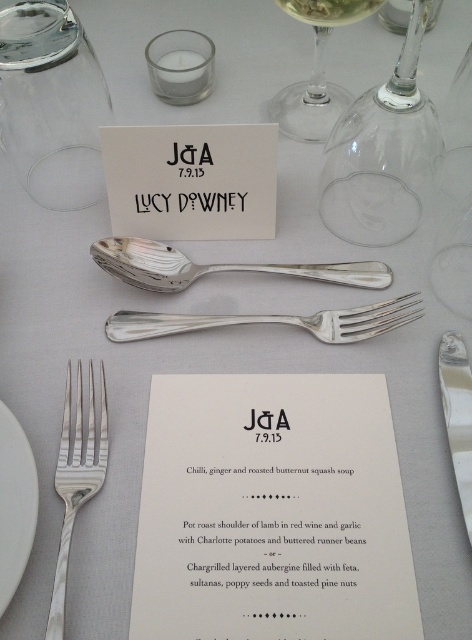
Question: Is silver polished spoon at center smaller than silver polished fork at center?

Choices:
 (A) no
 (B) yes

Answer: (A)

Question: Which object is farther from the camera taking this photo?

Choices:
 (A) clear glass wine at upper center
 (B) silver polished fork at lower left

Answer: (A)

Question: Which point is farther from the camera taking this photo?

Choices:
 (A) (165, 324)
 (B) (338, 10)
 (C) (451, 394)

Answer: (B)

Question: Where is silver polished spoon at center located in relation to polished silver fork at upper center in the image?

Choices:
 (A) left
 (B) right

Answer: (A)

Question: Can you confirm if transparent glass wine glass at upper right is positioned to the left of transparent glass wine glass at upper center?

Choices:
 (A) yes
 (B) no

Answer: (B)

Question: Which object is closer to the camera taking this photo?

Choices:
 (A) polished silver fork at upper center
 (B) silver polished fork at lower left

Answer: (B)